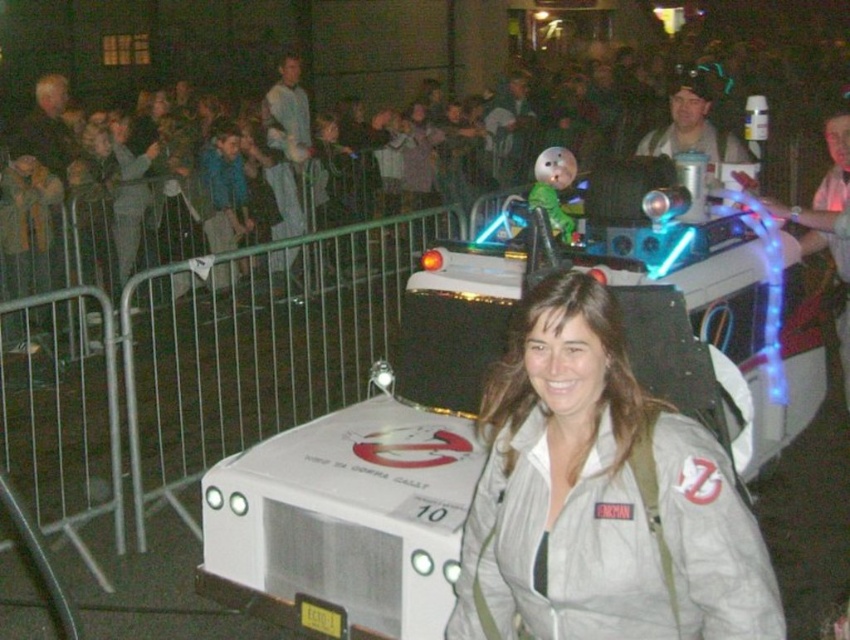
Consider the image. Does dark clothing crowd at upper center appear under white matte jacket at center?

No.

Is dark clothing crowd at upper center to the left of white matte jacket at center from the viewer's perspective?

No, dark clothing crowd at upper center is not to the left of white matte jacket at center.

Describe the element at coordinates (446, 58) in the screenshot. I see `dark clothing crowd at upper center` at that location.

Where is `dark clothing crowd at upper center`? This screenshot has height=640, width=850. dark clothing crowd at upper center is located at coordinates (446, 58).